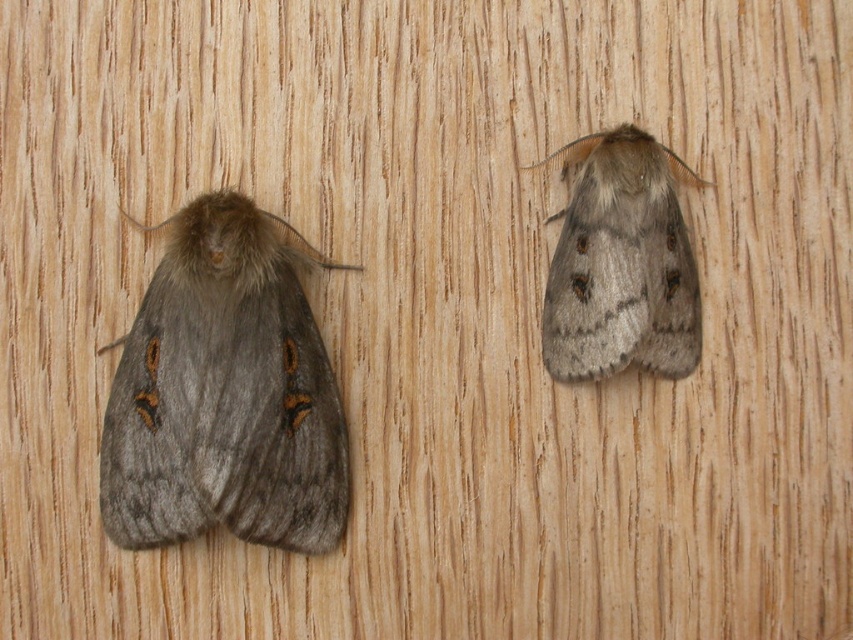
Question: Which object appears farthest from the camera in this image?

Choices:
 (A) fuzzy gray moth at left
 (B) fuzzy gray moth at right

Answer: (B)

Question: Which point is farther to the camera?

Choices:
 (A) (563, 237)
 (B) (119, 445)

Answer: (A)

Question: Can you confirm if fuzzy gray moth at left is thinner than fuzzy gray moth at right?

Choices:
 (A) no
 (B) yes

Answer: (A)

Question: Can you confirm if fuzzy gray moth at left is wider than fuzzy gray moth at right?

Choices:
 (A) no
 (B) yes

Answer: (B)

Question: Does fuzzy gray moth at left appear over fuzzy gray moth at right?

Choices:
 (A) no
 (B) yes

Answer: (A)